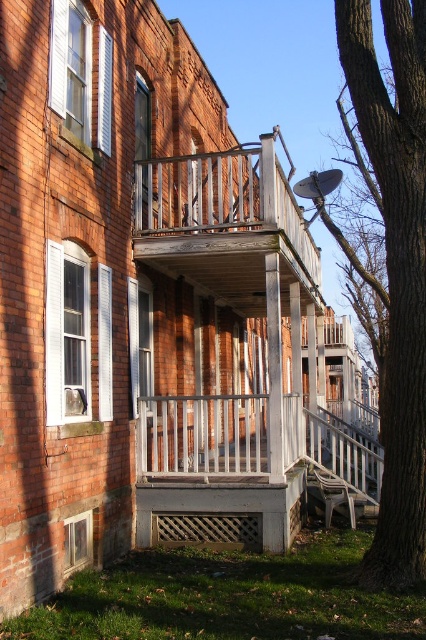
You are standing in front of the building and want to know which object is closer to you between the weathered wood balcony at center and the white wooden balustrade at center. Can you determine this based on their positions?

The weathered wood balcony at center is closer to you because the white wooden balustrade at center is positioned behind it.

You are standing in front of the row of brick townhouses and want to determine which object is taller. You see the brown rough bark tree at right and the weathered wood balcony at center. Which one is taller?

The brown rough bark tree at right is shorter than the weathered wood balcony at center, so the weathered wood balcony at center is taller.